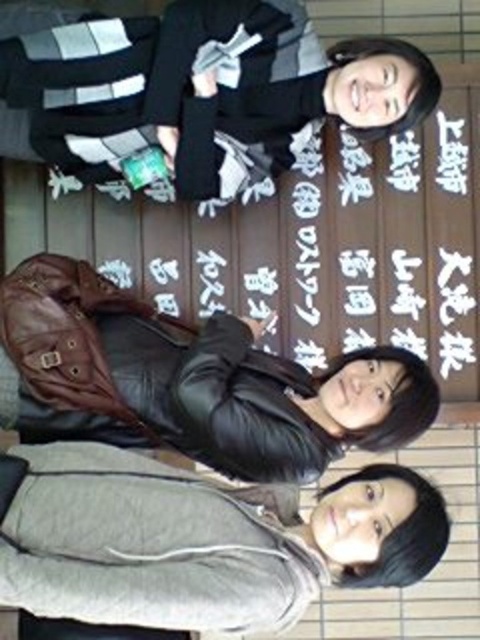
At what (x,y) coordinates should I click in order to perform the action: click on black leather jacket at upper center. Please return your answer as a coordinate pair (x, y). The width and height of the screenshot is (480, 640). Looking at the image, I should click on (193, 90).

Between black leather jacket at upper center and gray fleece jacket at lower right, which one is positioned lower?

gray fleece jacket at lower right is lower down.

Between point (180, 120) and point (182, 570), which one is positioned behind?

The point (180, 120) is behind.

Identify the location of black leather jacket at upper center. (193, 90).

Can you confirm if gray fleece jacket at lower right is positioned to the left of black leather jacket at center?

Incorrect, gray fleece jacket at lower right is not on the left side of black leather jacket at center.

Between point (267, 611) and point (345, 381), which one is positioned in front?

Point (267, 611) is in front.

Which is behind, point (116, 524) or point (167, 344)?

Positioned behind is point (167, 344).

Locate an element on the screen. The width and height of the screenshot is (480, 640). gray fleece jacket at lower right is located at coordinates (201, 541).

Can you confirm if black leather jacket at upper center is smaller than black leather jacket at center?

Actually, black leather jacket at upper center might be larger than black leather jacket at center.

Who is taller, black leather jacket at upper center or black leather jacket at center?

Standing taller between the two is black leather jacket at center.

Does point (291, 33) come behind point (173, 392)?

That is True.

Find the location of a particular element. black leather jacket at upper center is located at coordinates (193, 90).